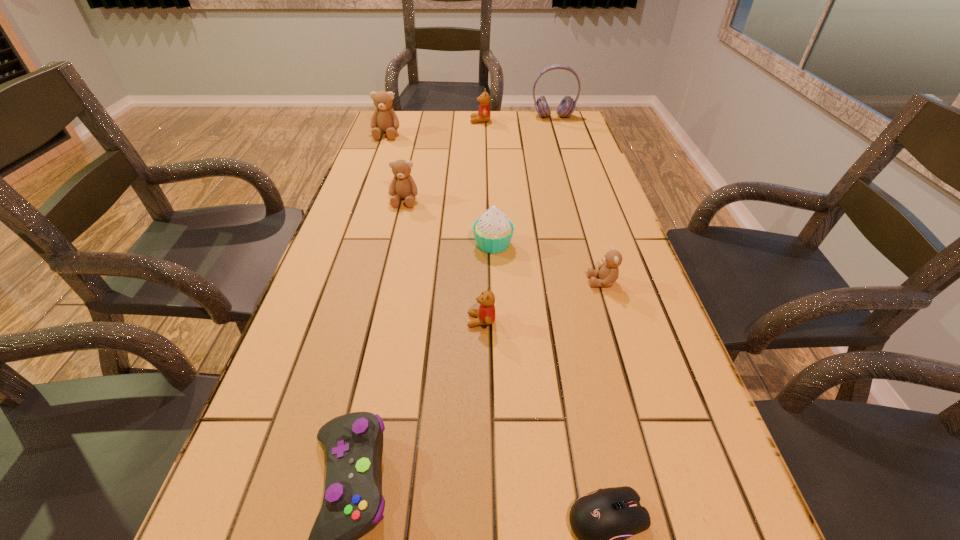
What are the coordinates of `vacant area located 0.210m on the front-facing side of the second nearest teddy bear` in the screenshot? It's located at [498, 282].

Where is `free space located 0.070m on the front-facing side of the second nearest teddy bear`? This screenshot has width=960, height=540. free space located 0.070m on the front-facing side of the second nearest teddy bear is located at coordinates (558, 282).

Locate an element on the screen. The image size is (960, 540). free space located on the front-facing side of the second nearest teddy bear is located at coordinates (x=465, y=282).

Where is `vacant space located on the front-facing side of the smaller red teddy bear`? This screenshot has height=540, width=960. vacant space located on the front-facing side of the smaller red teddy bear is located at coordinates (379, 321).

Image resolution: width=960 pixels, height=540 pixels. I want to click on vacant point located 0.350m on the front-facing side of the smaller red teddy bear, so click(304, 321).

Where is `vacant space situated on the front-facing side of the smaller red teddy bear`? This screenshot has height=540, width=960. vacant space situated on the front-facing side of the smaller red teddy bear is located at coordinates (308, 321).

Locate an element on the screen. This screenshot has width=960, height=540. headset at the far edge is located at coordinates (567, 105).

Identify the location of headset situated at the right edge. The height and width of the screenshot is (540, 960). (567, 105).

Identify the location of teddy bear that is at the right edge. click(608, 272).

The width and height of the screenshot is (960, 540). Find the location of `object present at the far left corner`. object present at the far left corner is located at coordinates (384, 119).